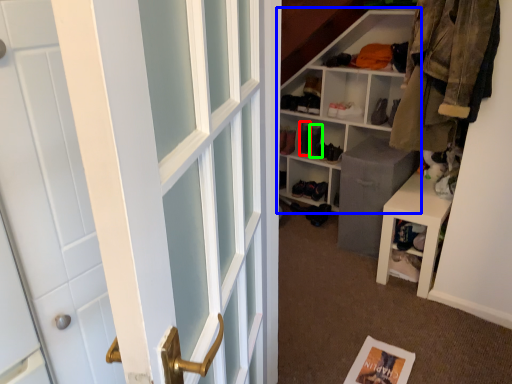
Question: Based on their relative distances, which object is nearer to shoe (highlighted by a red box)? Choose from shelf (highlighted by a blue box) and shoe (highlighted by a green box).

Choices:
 (A) shelf
 (B) shoe

Answer: (B)